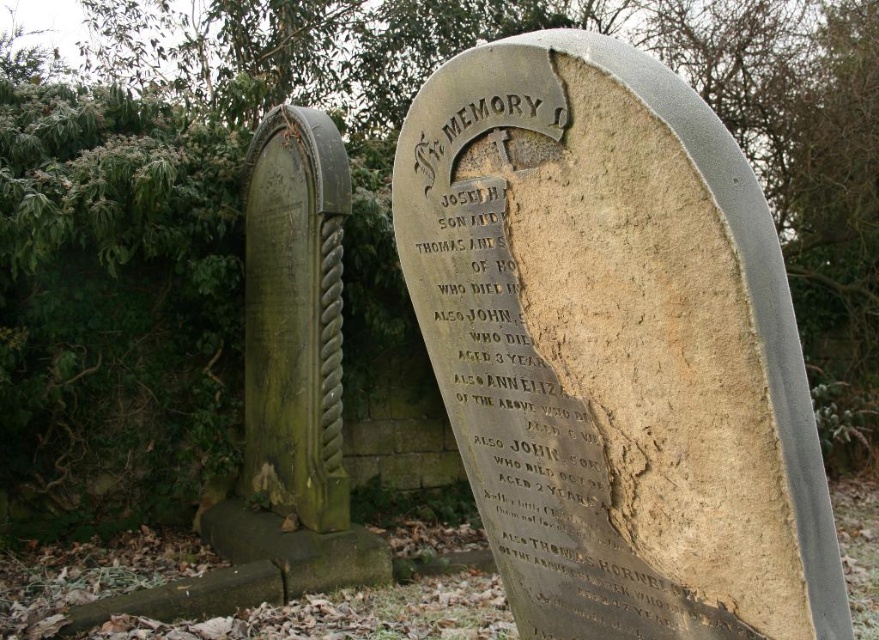
Question: Can you confirm if stone tombstone at center is thinner than green stone monument at left?

Choices:
 (A) no
 (B) yes

Answer: (B)

Question: Is stone tombstone at center in front of green stone monument at left?

Choices:
 (A) yes
 (B) no

Answer: (A)

Question: Which point is closer to the camera taking this photo?

Choices:
 (A) (516, 205)
 (B) (325, 304)

Answer: (A)

Question: Where is stone tombstone at center located in relation to green stone monument at left in the image?

Choices:
 (A) above
 (B) below

Answer: (A)